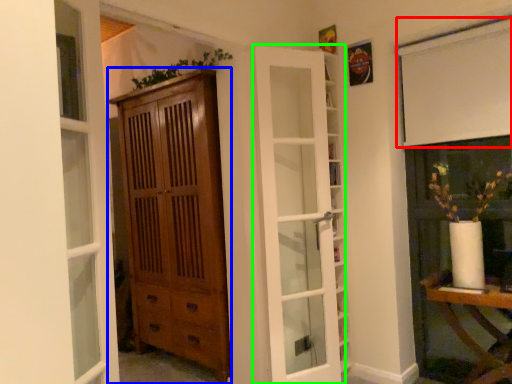
Question: Which object is the farthest from curtain (highlighted by a red box)? Choose among these: cabinetry (highlighted by a blue box) or door (highlighted by a green box).

Choices:
 (A) cabinetry
 (B) door

Answer: (A)